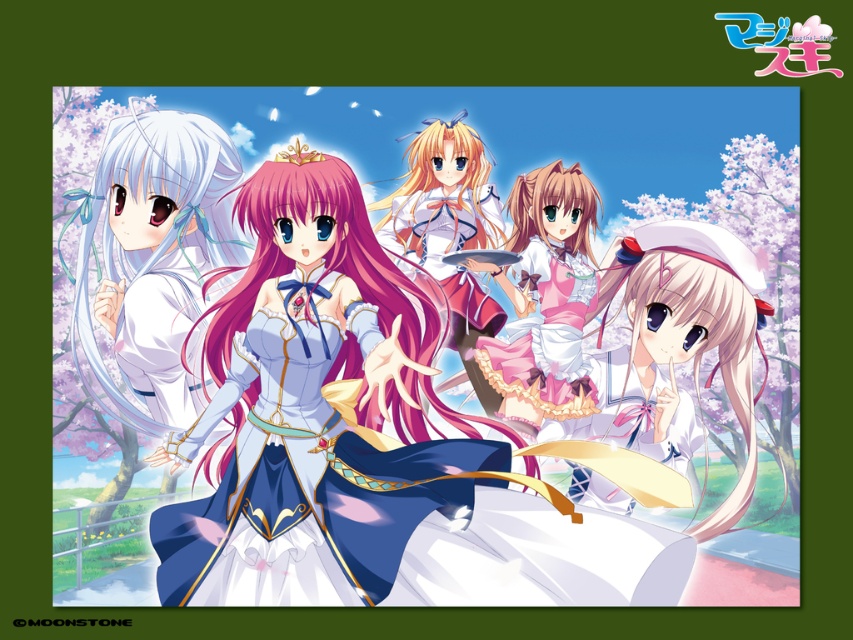
Between point (222, 323) and point (497, 241), which one is positioned behind?

Point (497, 241)

Who is higher up, satin white dress at center or smooth pink dress at center?

smooth pink dress at center

Identify the location of satin white dress at center. The width and height of the screenshot is (853, 640). (309, 410).

Can you confirm if satin white dress at left is positioned to the right of smooth pink dress at center?

Incorrect, satin white dress at left is not on the right side of smooth pink dress at center.

Is satin white dress at left taller than smooth pink dress at center?

No, satin white dress at left is not taller than smooth pink dress at center.

Is point (140, 147) in front of point (426, 186)?

Yes, it is.

The height and width of the screenshot is (640, 853). I want to click on satin white dress at left, so click(155, 260).

Is satin white dress at left to the left of pink satin dress at center from the viewer's perspective?

Correct, you'll find satin white dress at left to the left of pink satin dress at center.

Is satin white dress at left smaller than pink satin dress at center?

No, satin white dress at left is not smaller than pink satin dress at center.

Which is behind, point (82, 212) or point (596, 401)?

The point (596, 401) is behind.

Where is `satin white dress at left`? satin white dress at left is located at coordinates (155, 260).